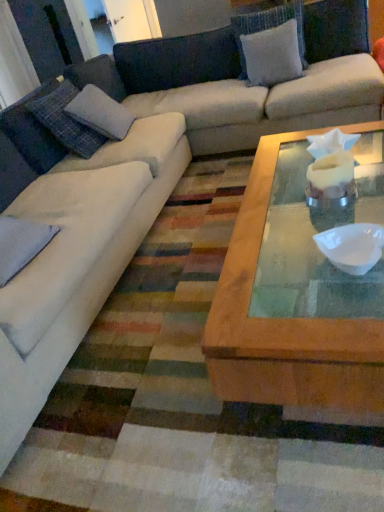
Question: From a real-world perspective, is white fabric pillow at upper center, which ranks as the 1th pillow in back-to-front order, beneath white matte bowl at center?

Choices:
 (A) no
 (B) yes

Answer: (A)

Question: Considering the relative sizes of white fabric pillow at upper center, which is counted as the third pillow, starting from the bottom, and white matte bowl at center in the image provided, is white fabric pillow at upper center, which is counted as the third pillow, starting from the bottom, wider than white matte bowl at center?

Choices:
 (A) yes
 (B) no

Answer: (A)

Question: Considering the relative sizes of white fabric pillow at upper center, which ranks as the 1th pillow in back-to-front order, and white matte bowl at center in the image provided, is white fabric pillow at upper center, which ranks as the 1th pillow in back-to-front order, shorter than white matte bowl at center?

Choices:
 (A) yes
 (B) no

Answer: (B)

Question: From the image's perspective, is white fabric pillow at upper center, acting as the first pillow starting from the right, over white matte bowl at center?

Choices:
 (A) no
 (B) yes

Answer: (B)

Question: Considering the relative positions of white fabric pillow at upper center, which is counted as the third pillow, starting from the bottom, and white matte bowl at center in the image provided, is white fabric pillow at upper center, which is counted as the third pillow, starting from the bottom, to the right of white matte bowl at center from the viewer's perspective?

Choices:
 (A) yes
 (B) no

Answer: (A)

Question: From a real-world perspective, relative to white matte bowl at center, is gray fabric pillow at left, which appears as the 2th pillow when viewed from the right, vertically above or below?

Choices:
 (A) above
 (B) below

Answer: (A)

Question: From the image's perspective, is gray fabric pillow at left, positioned as the second pillow in left-to-right order, located above or below white matte bowl at center?

Choices:
 (A) below
 (B) above

Answer: (B)

Question: Is point (18, 256) closer or farther from the camera than point (350, 229)?

Choices:
 (A) closer
 (B) farther

Answer: (B)

Question: From their relative heights in the image, would you say gray fabric pillow at left, which is the 1th pillow in bottom-to-top order, is taller or shorter than white matte bowl at center?

Choices:
 (A) tall
 (B) short

Answer: (A)

Question: From a real-world perspective, is white matte bowl at center physically located above or below gray fabric pillow at left, positioned as the second pillow in left-to-right order?

Choices:
 (A) above
 (B) below

Answer: (B)

Question: Is white matte bowl at center in front of or behind gray fabric pillow at left, positioned as the second pillow in left-to-right order, in the image?

Choices:
 (A) behind
 (B) front

Answer: (B)

Question: Is point (344, 258) closer or farther from the camera than point (38, 225)?

Choices:
 (A) farther
 (B) closer

Answer: (B)

Question: Is white matte bowl at center spatially inside gray fabric pillow at left, which appears as the 2th pillow when viewed from the right, or outside of it?

Choices:
 (A) outside
 (B) inside

Answer: (A)

Question: From a real-world perspective, is white fabric pillow at upper center, marked as the third pillow in a front-to-back arrangement, physically located above or below gray fabric pillow at left, which is the 1th pillow in bottom-to-top order?

Choices:
 (A) below
 (B) above

Answer: (B)

Question: In terms of width, does white fabric pillow at upper center, acting as the first pillow starting from the right, look wider or thinner when compared to gray fabric pillow at left, acting as the 3th pillow starting from the back?

Choices:
 (A) wide
 (B) thin

Answer: (B)